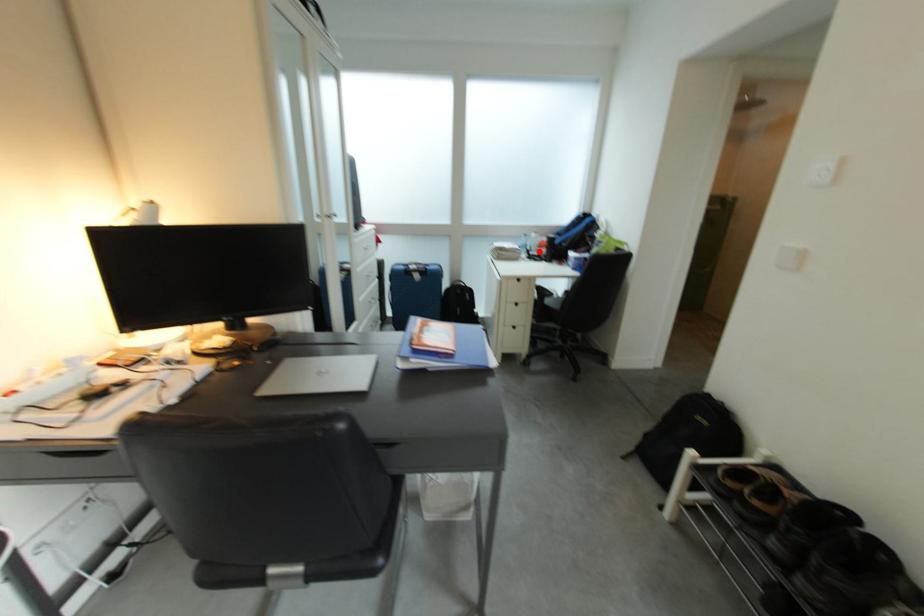
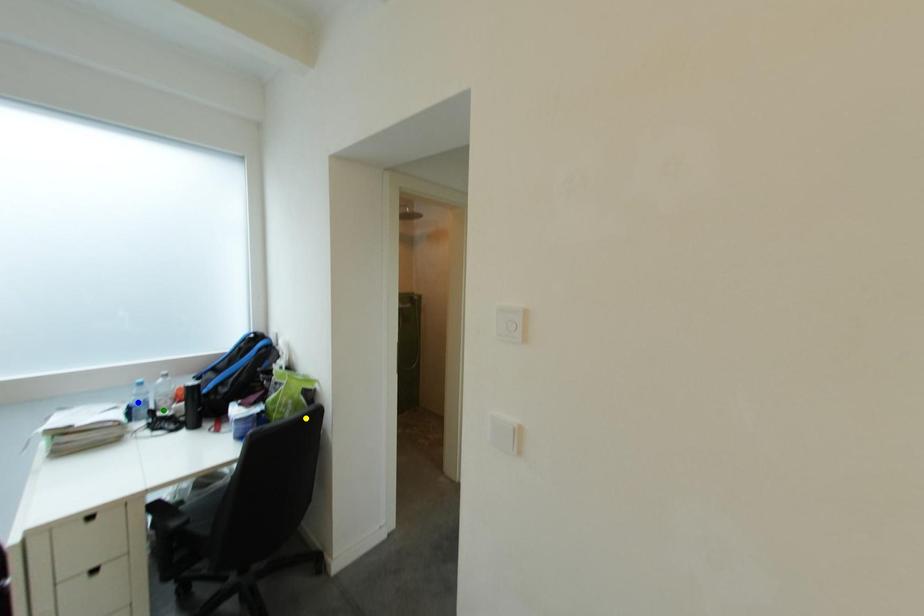
Question: I am providing you with two images of the same scene from different viewpoints. A red point is marked on the first image. You are given multiple points on the second image. Which point in image 2 represents the same 3d spot as the red point in image 1?

Choices:
 (A) green point
 (B) blue point
 (C) yellow point

Answer: (A)